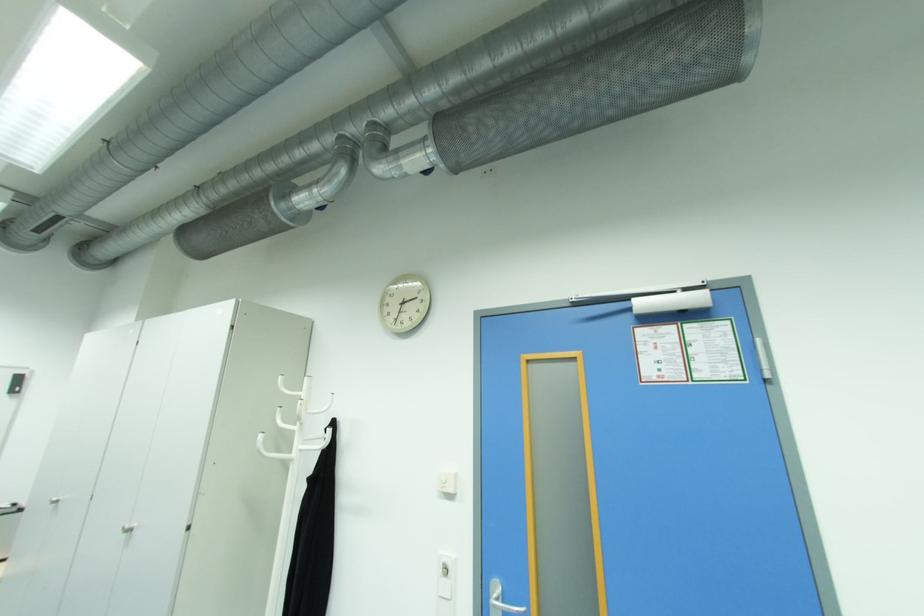
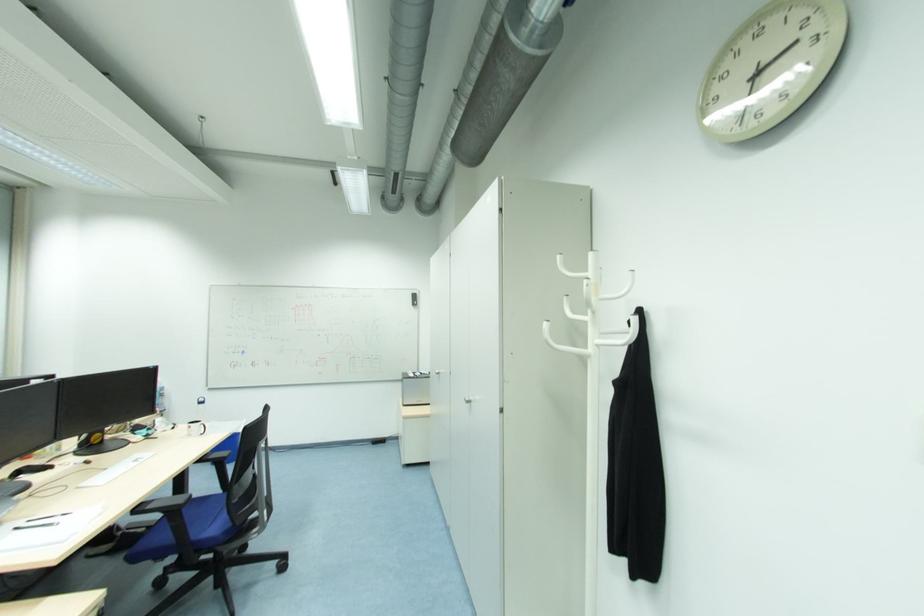
Locate, in the second image, the point that corresponds to (300,448) in the first image.

(596, 341)